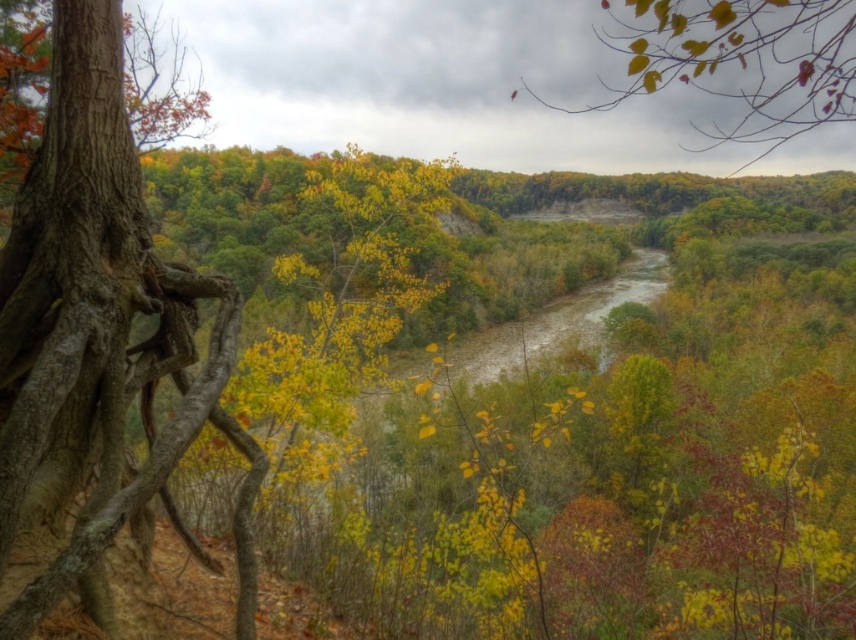
Question: From the image, what is the correct spatial relationship of smooth brown tree trunk at left in relation to yellow-green leaves at upper center?

Choices:
 (A) left
 (B) right

Answer: (A)

Question: Among these objects, which one is nearest to the camera?

Choices:
 (A) smooth brown tree trunk at left
 (B) yellow-green leaves at upper center

Answer: (A)

Question: Is smooth brown tree trunk at left bigger than yellow-green leaves at upper center?

Choices:
 (A) no
 (B) yes

Answer: (A)

Question: Does smooth brown tree trunk at left appear on the right side of yellow-green leaves at upper center?

Choices:
 (A) no
 (B) yes

Answer: (A)

Question: Which object appears farthest from the camera in this image?

Choices:
 (A) smooth brown tree trunk at left
 (B) yellow-green leaves at upper center

Answer: (B)